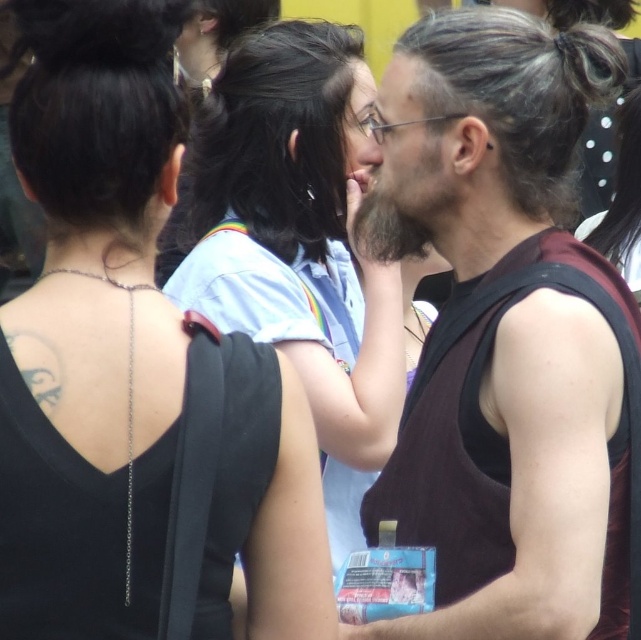
Question: Is black matte tank top at upper left thinner than matte blue shirt at center?

Choices:
 (A) no
 (B) yes

Answer: (B)

Question: Can you confirm if black matte tank top at upper left is bigger than matte black tank top at center?

Choices:
 (A) yes
 (B) no

Answer: (B)

Question: Among these points, which one is nearest to the camera?

Choices:
 (A) (272, 580)
 (B) (585, 74)
 (C) (363, 211)
 (D) (372, 132)

Answer: (A)

Question: Which point is closer to the camera?

Choices:
 (A) black matte tank top at upper left
 (B) black shiny hair at center
 (C) matte blue shirt at center
 (D) matte black tank top at center

Answer: (A)

Question: Which point is farther to the camera?

Choices:
 (A) (151, 144)
 (B) (367, 161)

Answer: (B)

Question: Is the position of dark brown fuzzy beard at center less distant than that of matte skin nose at center?

Choices:
 (A) no
 (B) yes

Answer: (B)